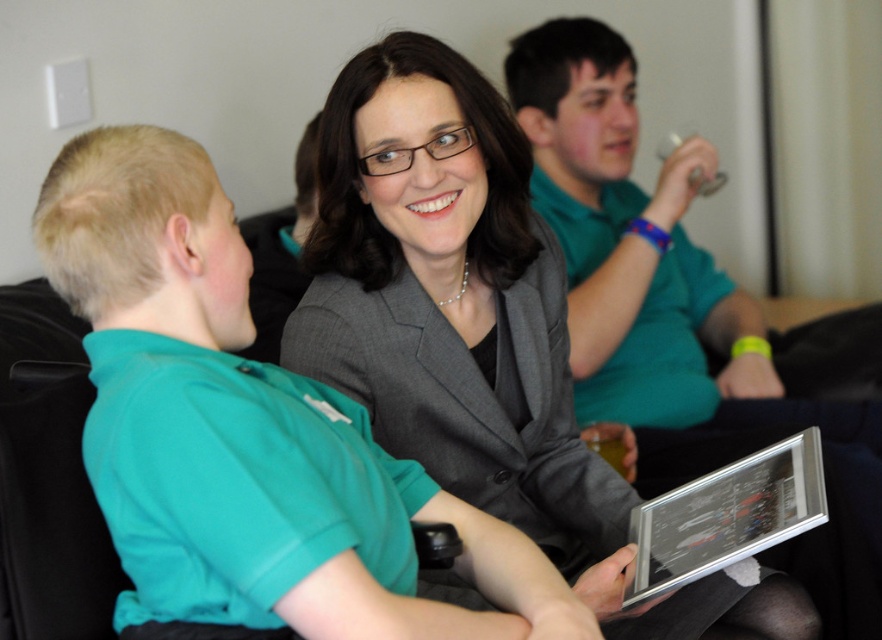
Question: Which is farther from the teal fabric shirt at left?

Choices:
 (A) silver metallic tablet at center
 (B) matte gray blazer at center

Answer: (A)

Question: Does matte gray blazer at center have a greater width compared to silver metallic tablet at center?

Choices:
 (A) no
 (B) yes

Answer: (B)

Question: Among these objects, which one is farthest from the camera?

Choices:
 (A) silver metallic tablet at center
 (B) teal fabric shirt at left

Answer: (A)

Question: Is teal fabric shirt at left to the left of silver metallic tablet at center from the viewer's perspective?

Choices:
 (A) yes
 (B) no

Answer: (A)

Question: Is matte gray blazer at center below silver metallic tablet at center?

Choices:
 (A) no
 (B) yes

Answer: (A)

Question: Which is nearer to the silver metallic tablet at center?

Choices:
 (A) matte gray blazer at center
 (B) teal fabric shirt at left

Answer: (A)